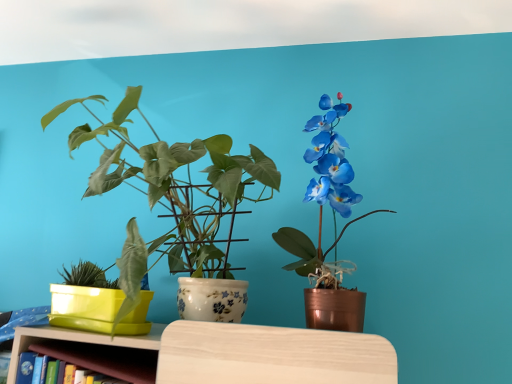
Question: From the image's perspective, would you say matte white pot at center, which appears as the second houseplant when viewed from the right, is shown under matte copper pot at right, the first houseplant in the right-to-left sequence?

Choices:
 (A) no
 (B) yes

Answer: (B)

Question: Are matte white pot at center, which is the second houseplant from left to right, and matte copper pot at right, the third houseplant when ordered from left to right, beside each other?

Choices:
 (A) no
 (B) yes

Answer: (A)

Question: Is matte white pot at center, which appears as the second houseplant when viewed from the right, smaller than matte copper pot at right, the third houseplant when ordered from left to right?

Choices:
 (A) no
 (B) yes

Answer: (A)

Question: Can you confirm if matte white pot at center, which is the second houseplant from left to right, is thinner than matte copper pot at right, the third houseplant when ordered from left to right?

Choices:
 (A) yes
 (B) no

Answer: (B)

Question: From the image's perspective, does matte white pot at center, which is the second houseplant from left to right, appear higher than matte copper pot at right, the first houseplant in the right-to-left sequence?

Choices:
 (A) yes
 (B) no

Answer: (B)

Question: Is matte yellow plastic pot at left, the first houseplant from the left, situated inside wooden shelf at lower left or outside?

Choices:
 (A) outside
 (B) inside

Answer: (A)

Question: From a real-world perspective, is matte yellow plastic pot at left, positioned as the 3th houseplant in right-to-left order, positioned above or below wooden shelf at lower left?

Choices:
 (A) above
 (B) below

Answer: (A)

Question: From the image's perspective, relative to wooden shelf at lower left, is matte yellow plastic pot at left, the first houseplant from the left, above or below?

Choices:
 (A) below
 (B) above

Answer: (B)

Question: Is matte yellow plastic pot at left, the first houseplant from the left, bigger or smaller than wooden shelf at lower left?

Choices:
 (A) big
 (B) small

Answer: (A)

Question: From a real-world perspective, is matte white pot at center, which appears as the second houseplant when viewed from the right, physically located above or below matte copper pot at right, the first houseplant in the right-to-left sequence?

Choices:
 (A) below
 (B) above

Answer: (A)

Question: Based on their sizes in the image, would you say matte white pot at center, which appears as the second houseplant when viewed from the right, is bigger or smaller than matte copper pot at right, the third houseplant when ordered from left to right?

Choices:
 (A) small
 (B) big

Answer: (B)

Question: In terms of width, does matte white pot at center, which appears as the second houseplant when viewed from the right, look wider or thinner when compared to matte copper pot at right, the first houseplant in the right-to-left sequence?

Choices:
 (A) thin
 (B) wide

Answer: (B)

Question: Based on their positions, is matte white pot at center, which is the second houseplant from left to right, located to the left or right of matte copper pot at right, the third houseplant when ordered from left to right?

Choices:
 (A) right
 (B) left

Answer: (B)

Question: Does point (104, 370) appear closer or farther from the camera than point (178, 187)?

Choices:
 (A) farther
 (B) closer

Answer: (B)

Question: Do you think wooden shelf at lower left is within matte white pot at center, which appears as the second houseplant when viewed from the right, or outside of it?

Choices:
 (A) inside
 (B) outside

Answer: (B)